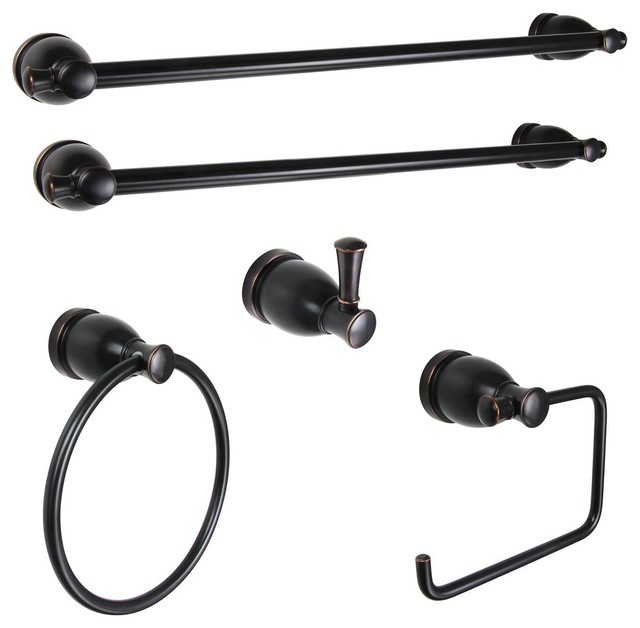
Find the location of a particular element. The width and height of the screenshot is (640, 628). rods is located at coordinates (349, 61), (317, 169).